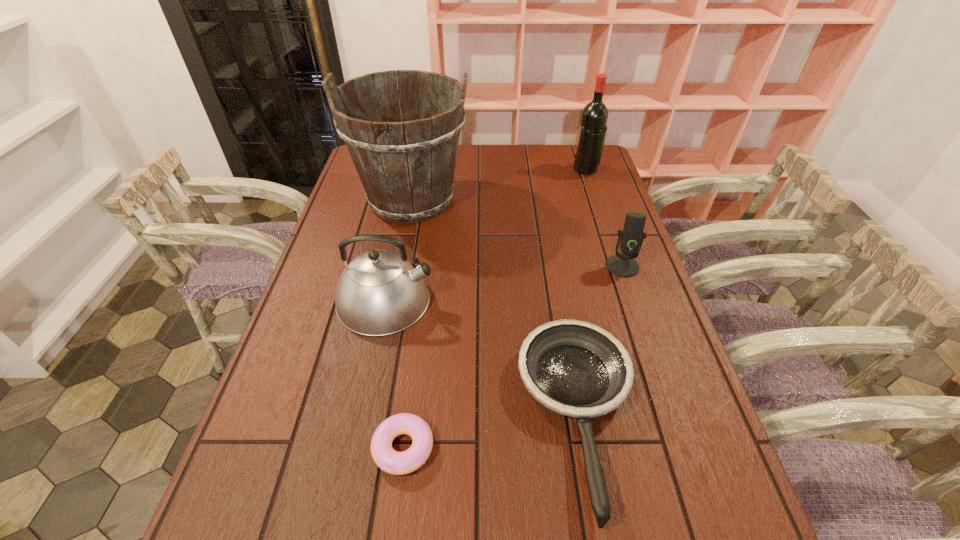
At what (x,y) coordinates should I click in order to perform the action: click on bucket. Please return your answer as a coordinate pair (x, y). The image size is (960, 540). Looking at the image, I should click on (406, 166).

Locate an element on the screen. Image resolution: width=960 pixels, height=540 pixels. wine bottle is located at coordinates (594, 116).

Where is `the fourth shortest object`? The height and width of the screenshot is (540, 960). the fourth shortest object is located at coordinates (380, 292).

I want to click on microphone, so tap(624, 265).

This screenshot has width=960, height=540. I want to click on frying pan, so click(575, 368).

Locate an element on the screen. the third object from right to left is located at coordinates (575, 368).

I want to click on doughnut, so point(387,459).

I want to click on vacant space located 0.370m on the right of the bucket, so pyautogui.click(x=581, y=199).

Where is `vacant region located 0.330m on the left of the second tallest object`? vacant region located 0.330m on the left of the second tallest object is located at coordinates (483, 170).

I want to click on blank area located 0.260m from the spout of the fourth shortest object, so click(535, 300).